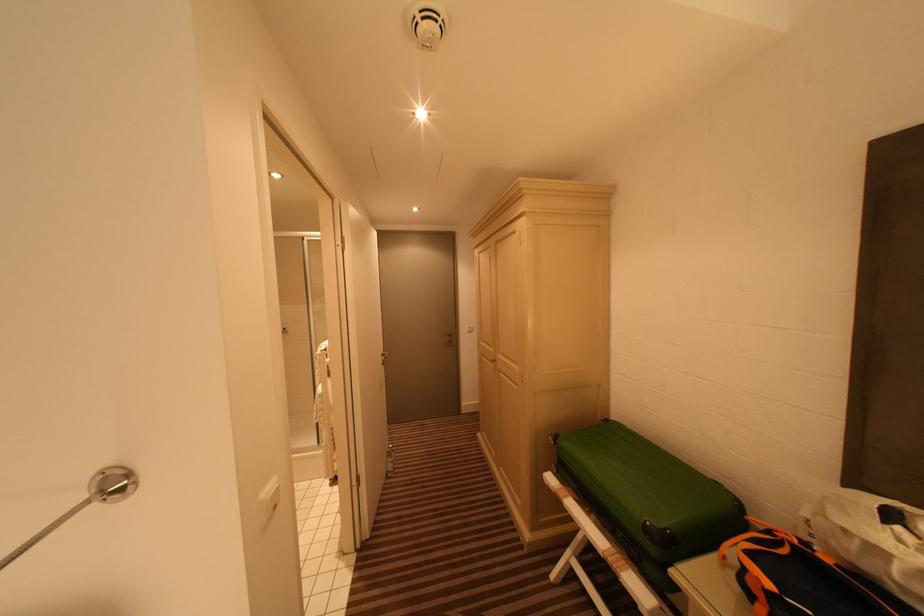
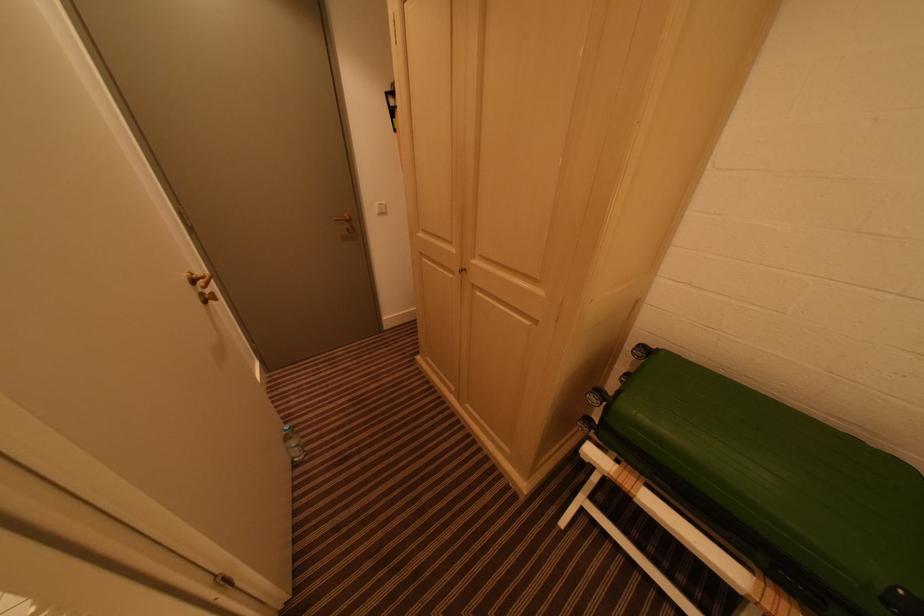
Find the pixel in the second image that matches (x=395, y=456) in the first image.

(293, 440)